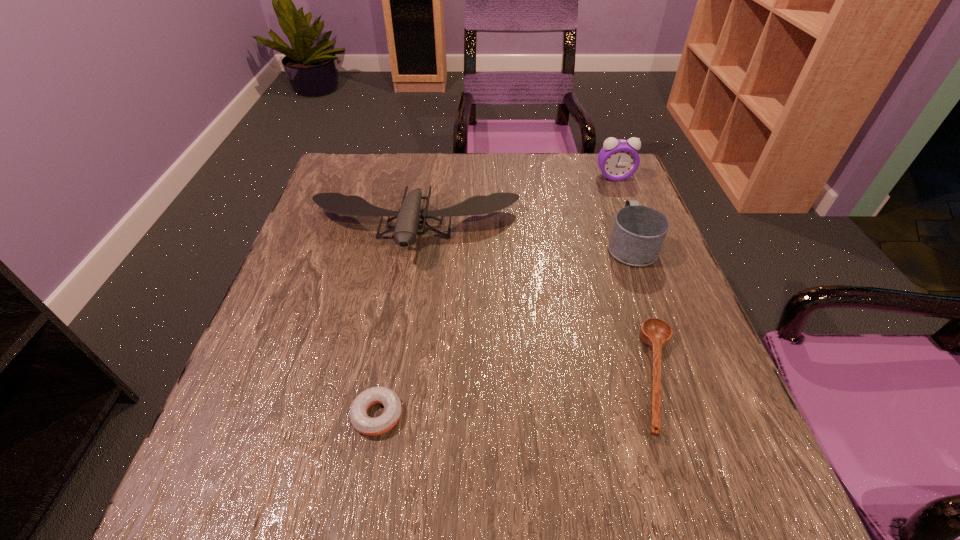
The width and height of the screenshot is (960, 540). Find the location of `vacant space located on the side of the mug with the handle`. vacant space located on the side of the mug with the handle is located at coordinates (617, 210).

Locate an element on the screen. This screenshot has width=960, height=540. vacant space located 0.100m on the front of the wooden spoon is located at coordinates (701, 515).

At what (x,y) coordinates should I click in order to perform the action: click on vacant space situated 0.300m on the right of the doughnut. Please return your answer as a coordinate pair (x, y). Looking at the image, I should click on (591, 415).

The width and height of the screenshot is (960, 540). In order to click on alarm clock that is at the far edge in this screenshot , I will do `click(618, 160)`.

Locate an element on the screen. Image resolution: width=960 pixels, height=540 pixels. drone that is at the far edge is located at coordinates (405, 230).

Locate an element on the screen. This screenshot has width=960, height=540. object that is at the left edge is located at coordinates (405, 230).

Find the location of a particular element. The height and width of the screenshot is (540, 960). alarm clock that is at the right edge is located at coordinates (618, 160).

This screenshot has width=960, height=540. I want to click on mug positioned at the right edge, so click(x=638, y=233).

Where is `wooden spoon located at the right edge`? The width and height of the screenshot is (960, 540). wooden spoon located at the right edge is located at coordinates (654, 332).

Where is `object located in the far left corner section of the desktop`? This screenshot has height=540, width=960. object located in the far left corner section of the desktop is located at coordinates (405, 230).